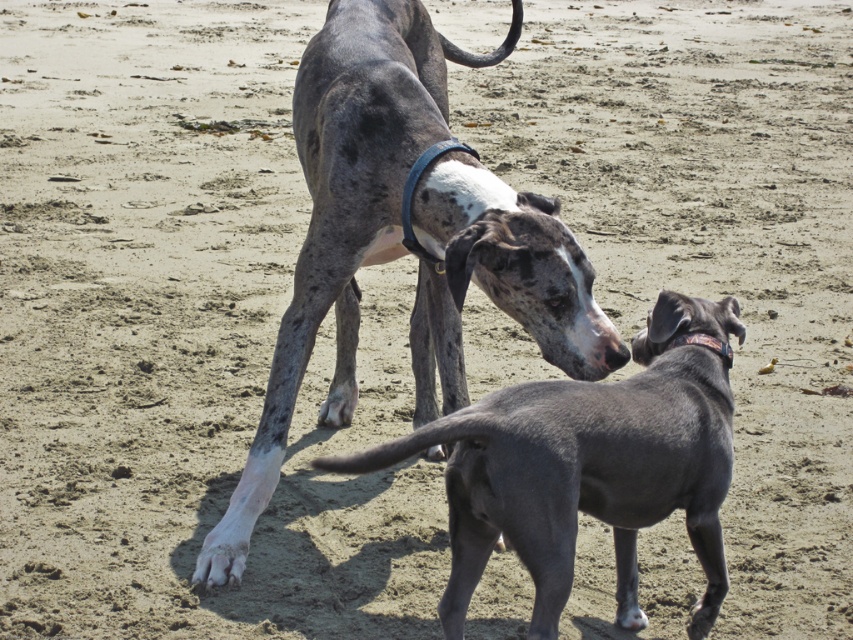
Question: Can you confirm if speckled fur dog at center is wider than smooth gray dog at center?

Choices:
 (A) no
 (B) yes

Answer: (B)

Question: Does speckled fur dog at center lie in front of smooth gray dog at center?

Choices:
 (A) no
 (B) yes

Answer: (A)

Question: Among these objects, which one is farthest from the camera?

Choices:
 (A) speckled fur dog at center
 (B) smooth gray dog at center

Answer: (A)

Question: Can you confirm if speckled fur dog at center is positioned above smooth gray dog at center?

Choices:
 (A) no
 (B) yes

Answer: (B)